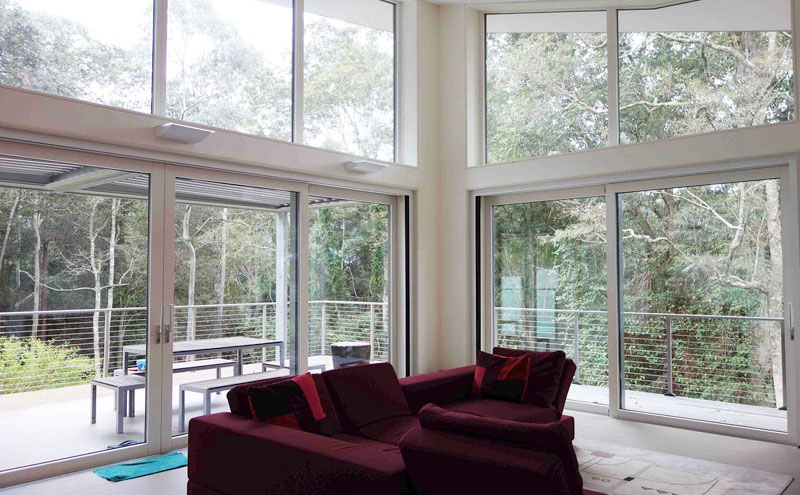
Find the location of a particular element. The image size is (800, 495). bench is located at coordinates (114, 382), (226, 382), (186, 361), (313, 363).